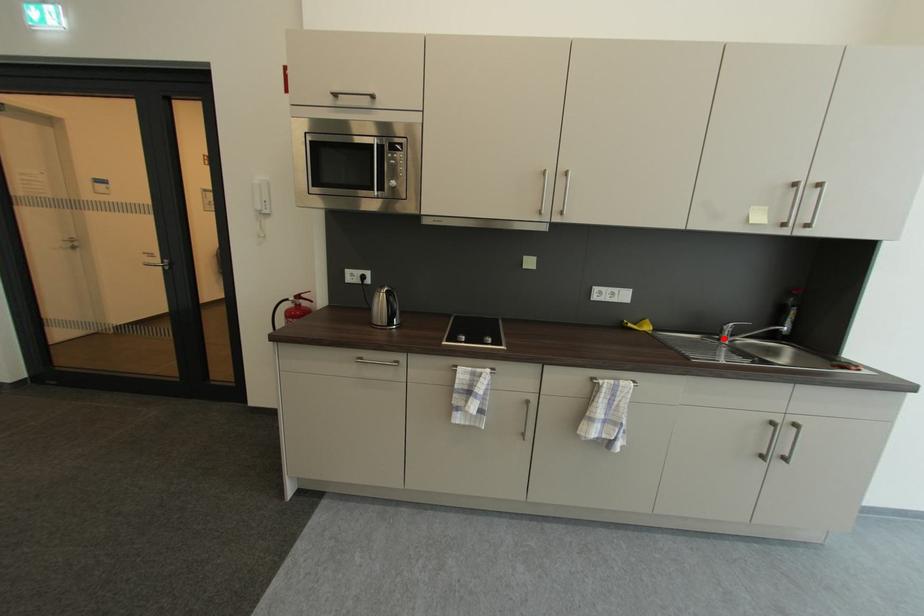
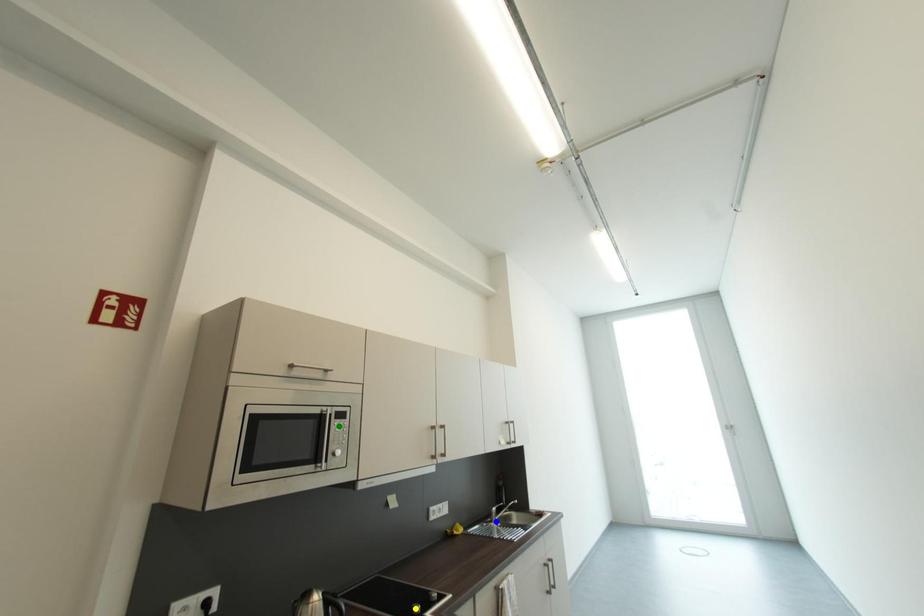
Question: I am providing you with two images of the same scene from different viewpoints. A red point is marked on the first image. You are given multiple points on the second image. Which point in image 2 is actually the same real-world point as the red point in image 1?

Choices:
 (A) yellow point
 (B) blue point
 (C) green point

Answer: (B)